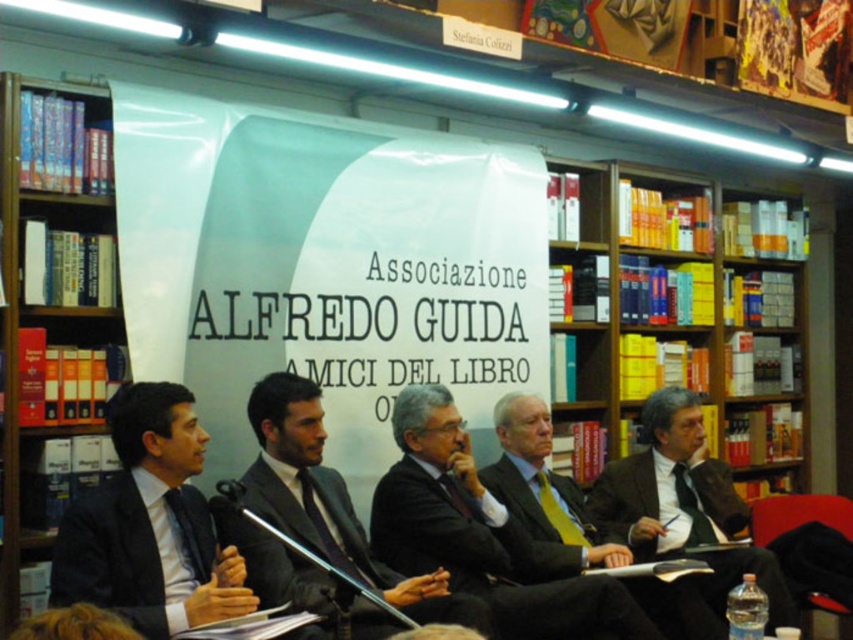
Is black matte suit at center further to the viewer compared to black matte suit at left?

Yes, it is.

Is black matte suit at center thinner than black matte suit at left?

No, black matte suit at center is not thinner than black matte suit at left.

Measure the distance between black matte suit at center and camera.

They are 9.81 feet apart.

Locate an element on the screen. black matte suit at center is located at coordinates (492, 557).

Between wooden bookshelf at left and dark suit at center, which one appears on the left side from the viewer's perspective?

From the viewer's perspective, wooden bookshelf at left appears more on the left side.

Can you confirm if wooden bookshelf at left is positioned below dark suit at center?

No.

Between point (48, 221) and point (260, 428), which one is positioned behind?

Point (48, 221)

The height and width of the screenshot is (640, 853). In order to click on wooden bookshelf at left in this screenshot , I will do `click(51, 349)`.

Looking at this image, is wooden bookshelf at left shorter than black matte suit at center?

No.

Can you confirm if wooden bookshelf at left is smaller than black matte suit at center?

Incorrect, wooden bookshelf at left is not smaller in size than black matte suit at center.

Does point (38, 339) come farther from viewer compared to point (547, 552)?

No.

Find the location of a particular element. The height and width of the screenshot is (640, 853). wooden bookshelf at left is located at coordinates (51, 349).